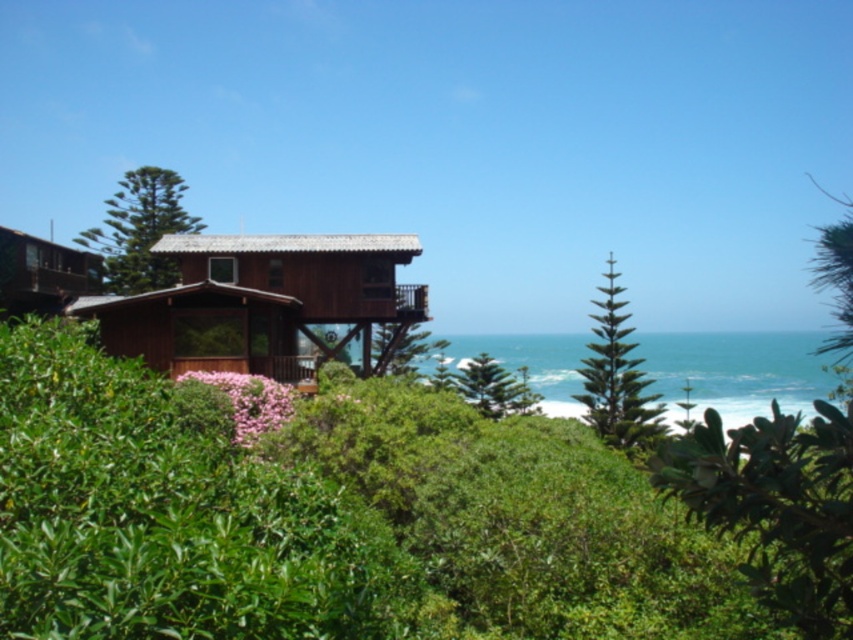
Consider the image. You are planning to build a new garden shed and want to ensure it has a clear view of the ocean. Based on the scene, is the wooden cabin at center positioned in a way that it might block the view from the green textured pine tree at upper left?

The wooden cabin at center is below the green textured pine tree at upper left, so the cabin is lower in position. This means the pine tree at upper left is higher up, so the cabin would not block the view from the pine tree. Therefore, building the shed where the pine tree is located would still allow for an unobstructed ocean view.

You are a delivery drone trying to deliver a package to the wooden cabin at center. The GPS coordinates of the cabin are at point 0.473, 0.311. If you are currently at point 0.5, 0.5, in which direction should you fly to reach the cabin?

The wooden cabin at center is located at point (264, 301). Since your current position is at (426, 320), you should fly southwest to reach the cabin.

You are a visitor standing in front of the wooden house. You notice the green leafy tree at center and the wooden hut at left. Which object is higher in the scene?

The green leafy tree at center is located above the wooden hut at left, so it is higher in the scene.